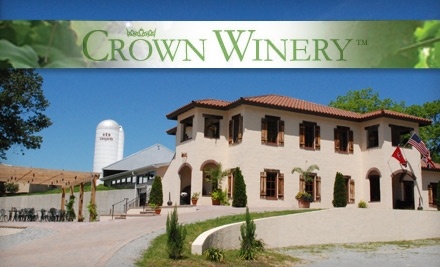
This screenshot has height=267, width=440. What are the coordinates of `wooden structure left side` in the screenshot? It's located at (15, 175).